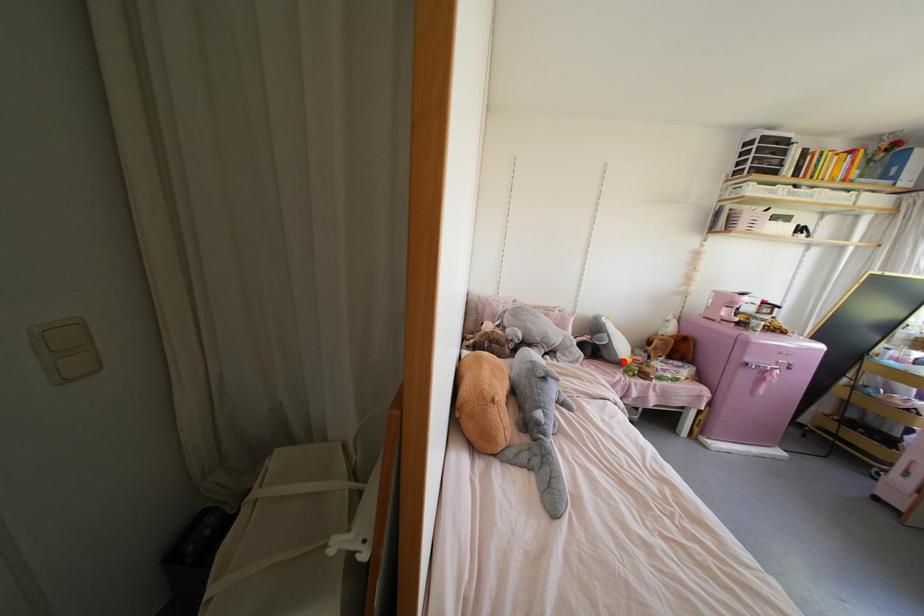
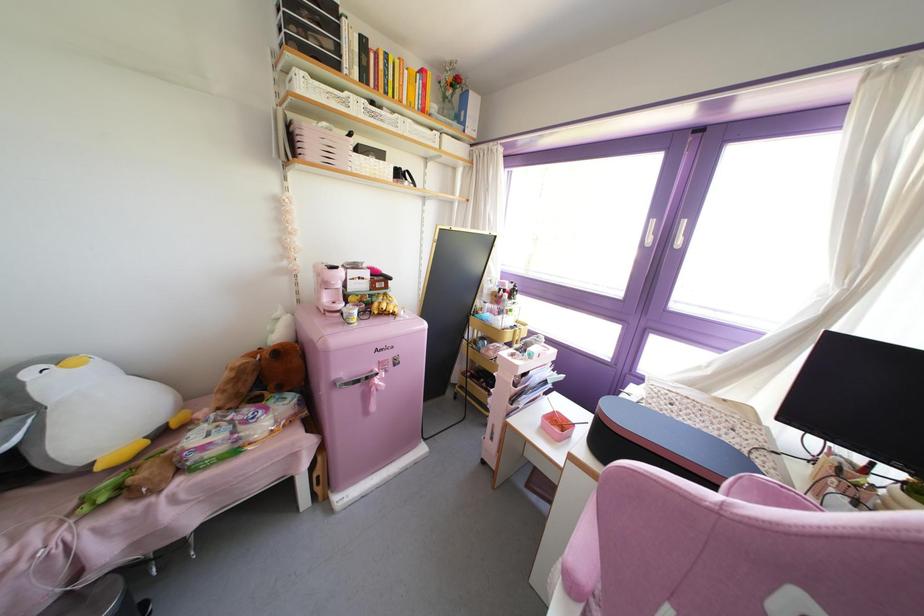
Find the pixel in the second image that matches the highlighted location in the first image.

(99, 467)